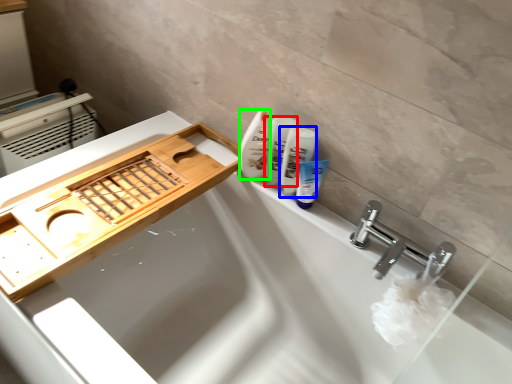
Question: Which object is the closest to the toiletry (highlighted by a red box)? Choose among these: mouthwash (highlighted by a blue box) or cleaning product (highlighted by a green box).

Choices:
 (A) mouthwash
 (B) cleaning product

Answer: (B)